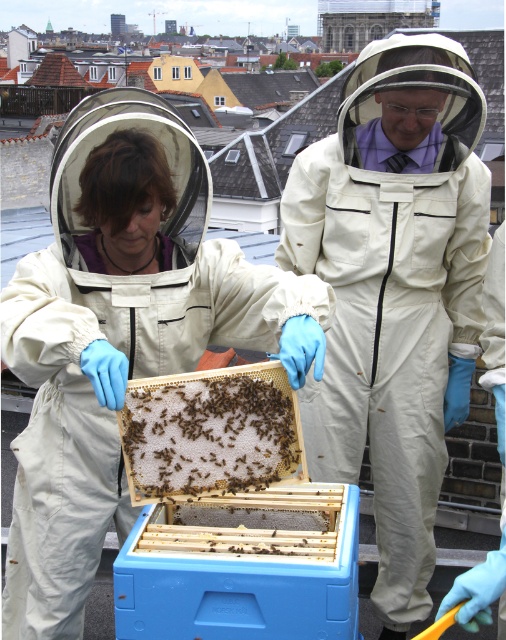
You are standing on the rooftop and see two points marked in the image. Which point is closer to you, point (180, 234) or point (233, 451)?

Point (233, 451) is closer to you because point (180, 234) is behind it.

In the scene shown: You are a drone operator trying to capture a closeup of the white fabric beekeeper suit at center. The camera is currently positioned at point 0.5, 0.5. Should you move the camera to the left or right to get a better shot?

The white fabric beekeeper suit at center is located at point (x=394, y=292). Since the camera is at (x=253, y=320), it needs to move slightly to the left and upwards to align with the target.

You are a beekeeper inspecting two items at the center of your observation area. You have a brown wax comb at center and a brown fuzzy honeycomb at center. Which one is larger in size?

The brown wax comb at center is bigger than the brown fuzzy honeycomb at center.